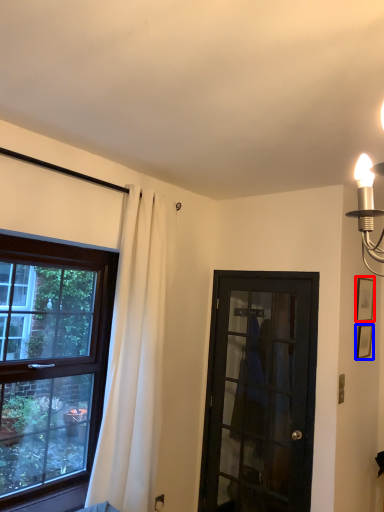
Question: Which point is closer to the camera, picture frame (highlighted by a red box) or picture frame (highlighted by a blue box)?

Choices:
 (A) picture frame
 (B) picture frame

Answer: (B)